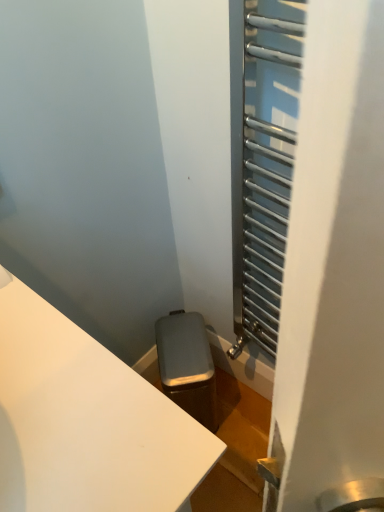
Question: Should I look upward or downward to see metallic silver radiator at right?

Choices:
 (A) down
 (B) up

Answer: (B)